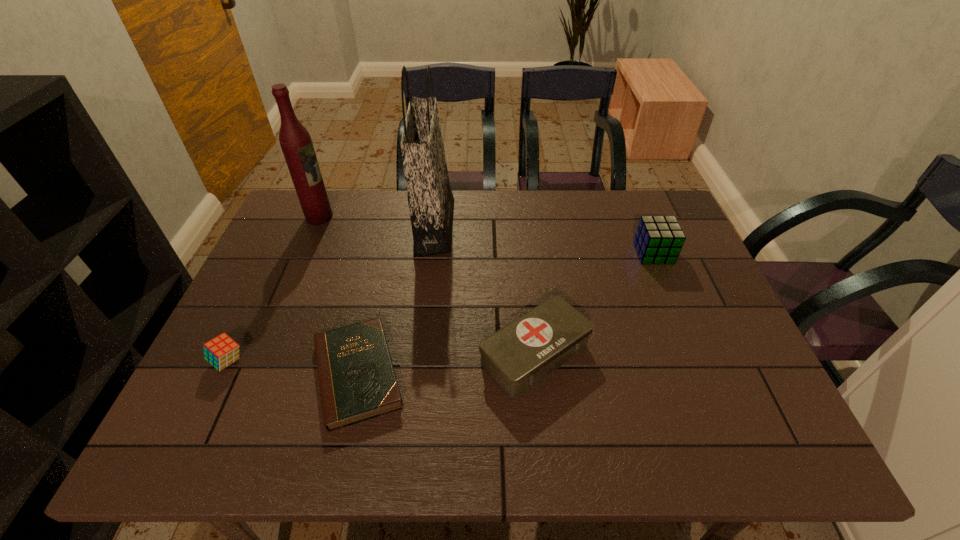
This screenshot has height=540, width=960. What are the coordinates of `object located at the far left corner` in the screenshot? It's located at (295, 141).

Where is `free space at the far edge of the desktop`? The image size is (960, 540). free space at the far edge of the desktop is located at coordinates (563, 205).

In the image, there is a desktop. Where is `vacant space at the near edge`? The image size is (960, 540). vacant space at the near edge is located at coordinates (591, 453).

You are a GUI agent. You are given a task and a screenshot of the screen. Output one action in this format:
    pyautogui.click(x=<x>, y=<y>)
    Task: Click on the vacant space at the left edge
    This screenshot has width=960, height=540.
    Given the screenshot: What is the action you would take?
    pyautogui.click(x=238, y=306)

In order to click on blank space at the right edge in this screenshot , I will do `click(680, 331)`.

You are a GUI agent. You are given a task and a screenshot of the screen. Output one action in this format:
    pyautogui.click(x=<x>, y=<y>)
    Task: Click on the free space between the shopping bag and the liquor
    This screenshot has width=960, height=540.
    Given the screenshot: What is the action you would take?
    pyautogui.click(x=376, y=222)

At what (x,y) coordinates should I click in order to perform the action: click on empty space between the rightmost object and the fifth object from left to right. Please return your answer as a coordinate pair (x, y). Looking at the image, I should click on (594, 304).

You are a GUI agent. You are given a task and a screenshot of the screen. Output one action in this format:
    pyautogui.click(x=<x>, y=<y>)
    Task: Click on the free spot between the farther cube and the shopping bag
    The image size is (960, 540).
    Given the screenshot: What is the action you would take?
    pyautogui.click(x=543, y=240)

Where is `empty space that is in between the left cube and the shortest object`? empty space that is in between the left cube and the shortest object is located at coordinates (293, 368).

I want to click on vacant area that lies between the farther cube and the shopping bag, so 543,240.